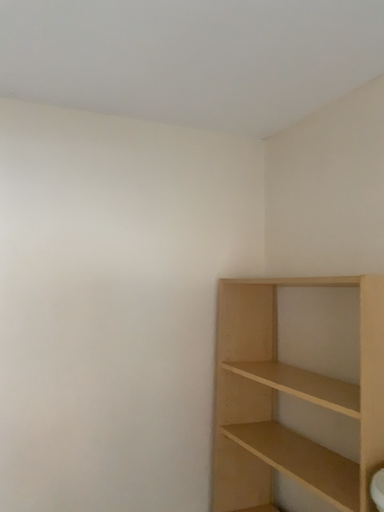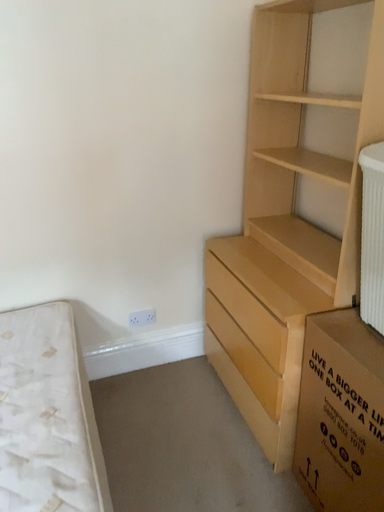
Question: Which way did the camera rotate in the video?

Choices:
 (A) rotated downward
 (B) rotated upward

Answer: (A)